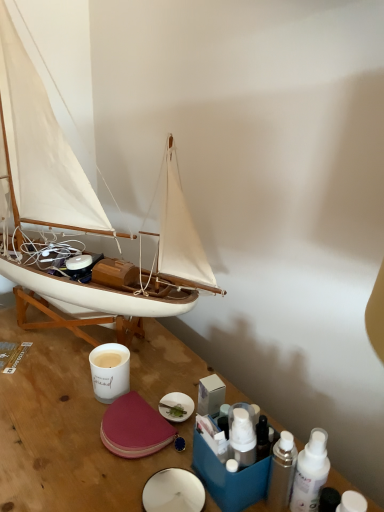
At what (x,y) coordinates should I click in order to perform the action: click on vacant region to the left of white matte cup at center. Please return your answer as a coordinate pair (x, y). Image resolution: width=384 pixels, height=512 pixels. Looking at the image, I should click on (46, 381).